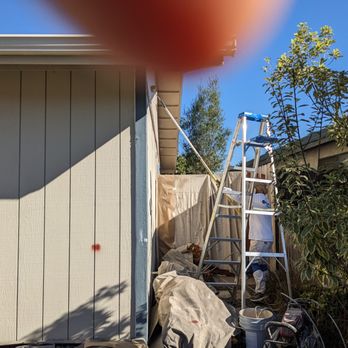
Where is `brown door`? The image size is (348, 348). brown door is located at coordinates (73, 260).